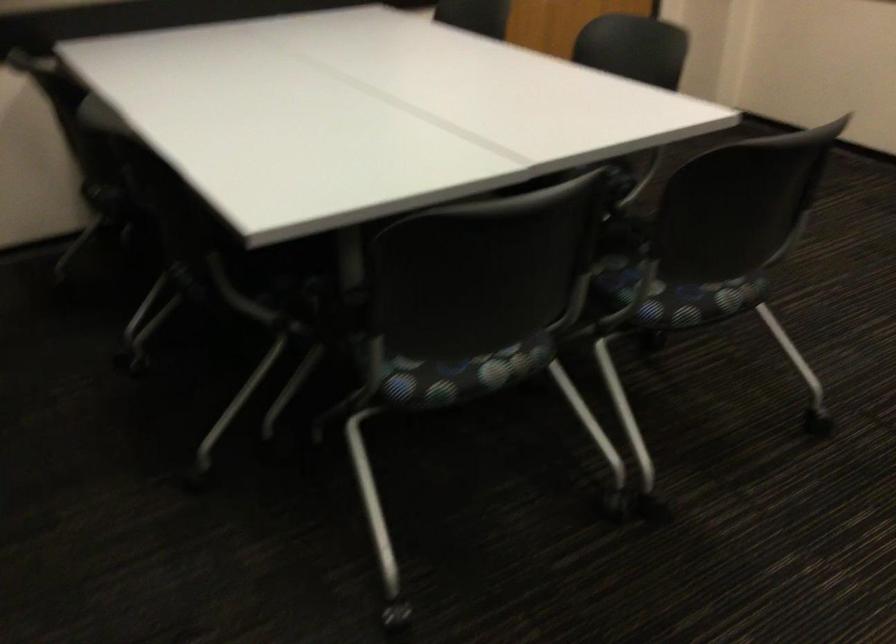
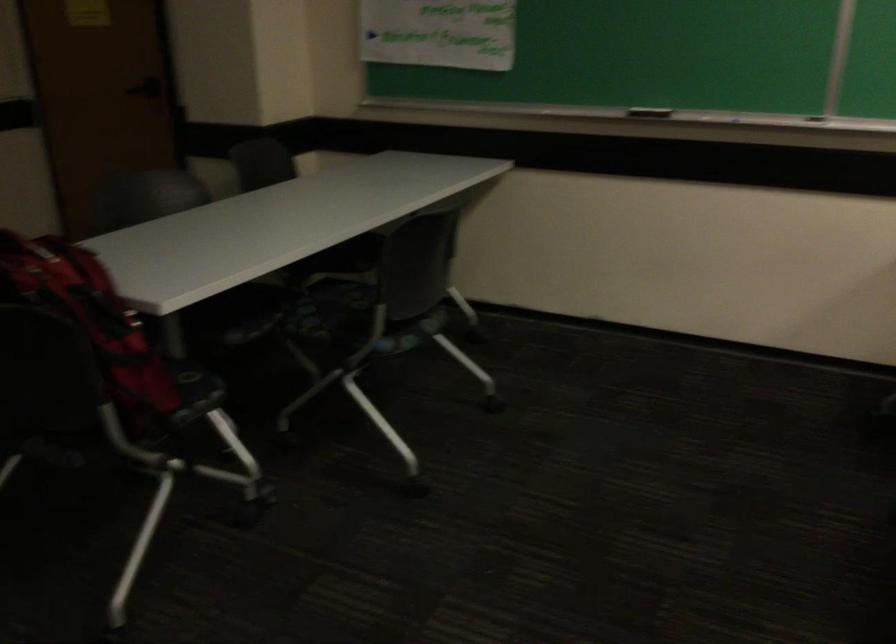
Question: The first image is from the beginning of the video and the second image is from the end. How did the camera likely rotate when shooting the video?

Choices:
 (A) Left
 (B) Right
 (C) Up
 (D) Down

Answer: (A)